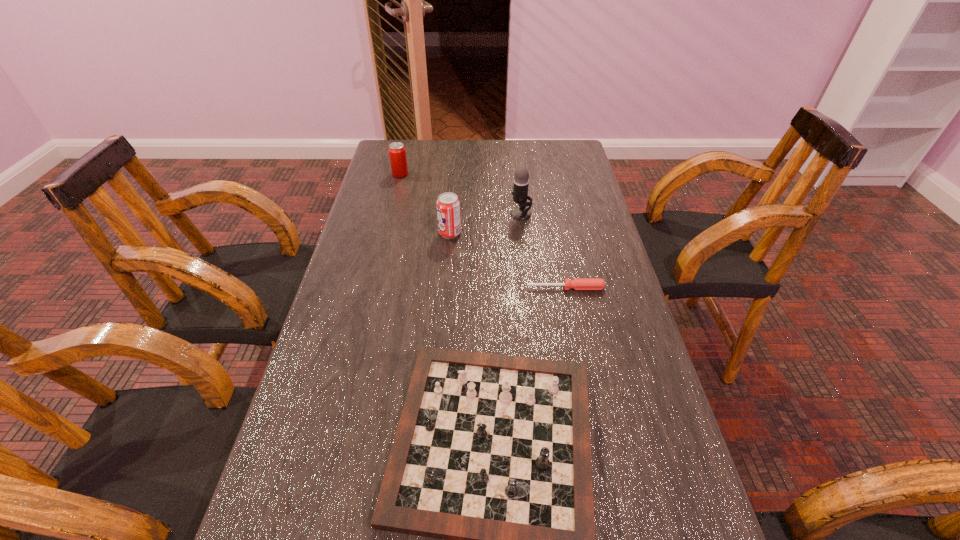
This screenshot has height=540, width=960. Find the location of `the tallest object`. the tallest object is located at coordinates (521, 181).

I want to click on microphone, so click(521, 181).

You are a GUI agent. You are given a task and a screenshot of the screen. Output one action in this format:
    pyautogui.click(x=<x>, y=<y>)
    Task: Click on the soda can
    This screenshot has width=960, height=540.
    Given the screenshot: What is the action you would take?
    pyautogui.click(x=448, y=205)

The width and height of the screenshot is (960, 540). Find the location of `the third shortest object`. the third shortest object is located at coordinates (397, 153).

The image size is (960, 540). I want to click on the leftmost object, so click(397, 153).

Where is `the second nearest object`? the second nearest object is located at coordinates (578, 283).

Where is `screwdriver`? screwdriver is located at coordinates 578,283.

Where is `free space located 0.200m on the front of the tallest object`? The image size is (960, 540). free space located 0.200m on the front of the tallest object is located at coordinates (527, 266).

Locate an element on the screen. The height and width of the screenshot is (540, 960). free space located 0.170m on the front of the soda can is located at coordinates (446, 282).

Find the location of a particular element. The image size is (960, 540). vacant space located on the right of the third shortest object is located at coordinates (497, 174).